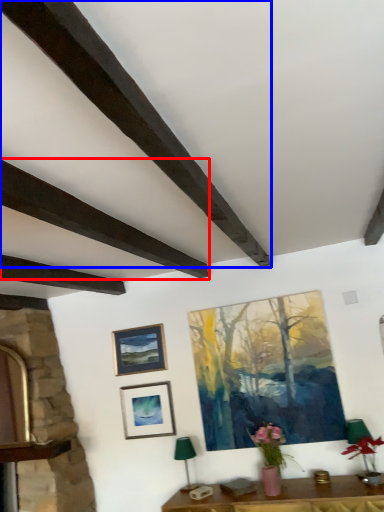
Question: Which of the following is the closest to the observer, plank (highlighted by a red box) or plank (highlighted by a blue box)?

Choices:
 (A) plank
 (B) plank

Answer: (B)